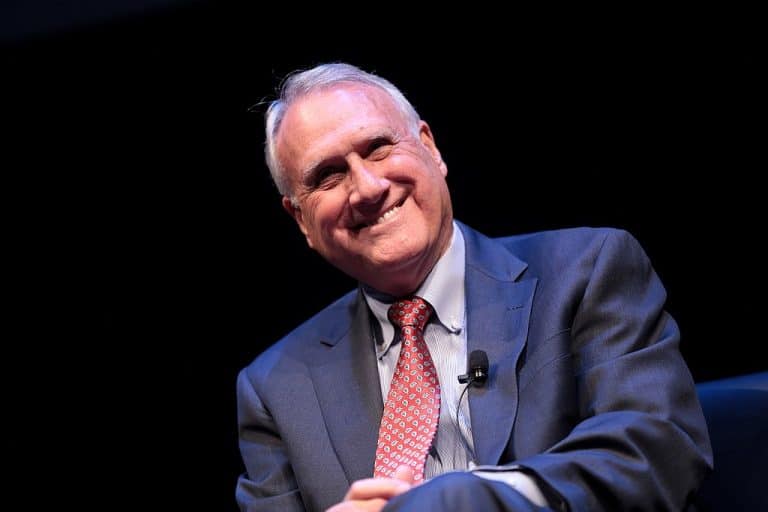
At what (x,y) coordinates should I click in order to perform the action: click on cable. Please return your answer as a coordinate pair (x, y). This screenshot has width=768, height=512. Looking at the image, I should click on (461, 405).